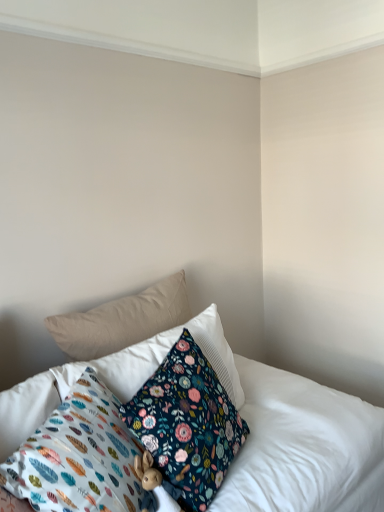
Question: Considering the relative positions of floral fabric pillow at center, acting as the 3th pillow starting from the front, and floral fabric pillow at lower center, which is the 4th pillow in back-to-front order, in the image provided, is floral fabric pillow at center, acting as the 3th pillow starting from the front, to the left or to the right of floral fabric pillow at lower center, which is the 4th pillow in back-to-front order,?

Choices:
 (A) right
 (B) left

Answer: (A)

Question: Based on their sizes in the image, would you say floral fabric pillow at center, acting as the 3th pillow starting from the front, is bigger or smaller than floral fabric pillow at lower center, which is the 1th pillow from front to back?

Choices:
 (A) small
 (B) big

Answer: (B)

Question: Which object is positioned farthest from the floral fabric pillow at lower center, which is the 4th pillow in back-to-front order?

Choices:
 (A) floral fabric pillow at center, acting as the 3th pillow starting from the front
 (B) floral fabric pillow at center, acting as the 3th pillow starting from the back
 (C) beige fabric pillow at upper left, positioned as the 4th pillow in front-to-back order

Answer: (C)

Question: Which of these objects is positioned closest to the floral fabric pillow at center, arranged as the second pillow when viewed from the front?

Choices:
 (A) floral fabric pillow at center, marked as the 2th pillow in a back-to-front arrangement
 (B) beige fabric pillow at upper left, the first pillow when ordered from back to front
 (C) floral fabric pillow at lower center, which is the 1th pillow from front to back

Answer: (C)